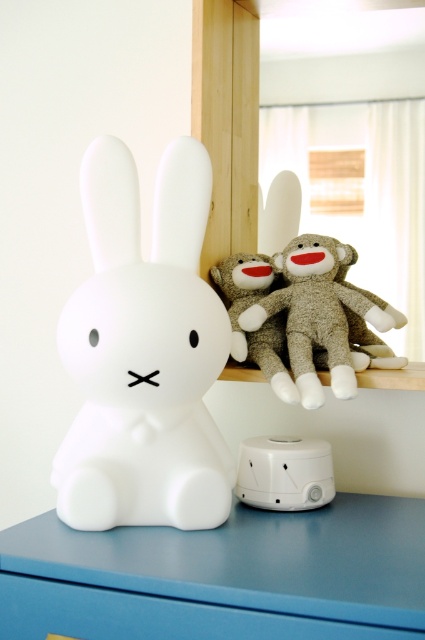
You are organizing a nursery and need to place a small plant between the blue matte drawer at lower center and the white plastic humidifier at lower center. Can you fit it vertically between them?

The blue matte drawer at lower center is below the white plastic humidifier at lower center, so there is vertical space between them. You can fit the small plant vertically between them.

From the picture: You are a parent organizing your child room. You have a white matte rabbit at center and a blue matte drawer at lower center. Which object takes up more space in the room?

The white matte rabbit at center is bigger than the blue matte drawer at lower center, so it takes up more space in the room.

You are a parent trying to place a new toy in the nursery. You have two options for placement based on coordinates given. The first option is at point (170, 609) and the second is at point (278, 477). Which point is closer to the rabbit nightlight?

Point (170, 609) is in front of point (278, 477), so it is closer to the rabbit nightlight.